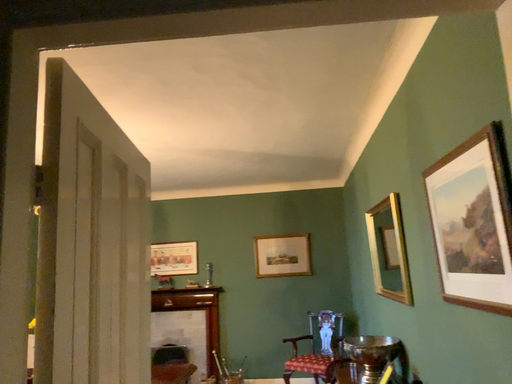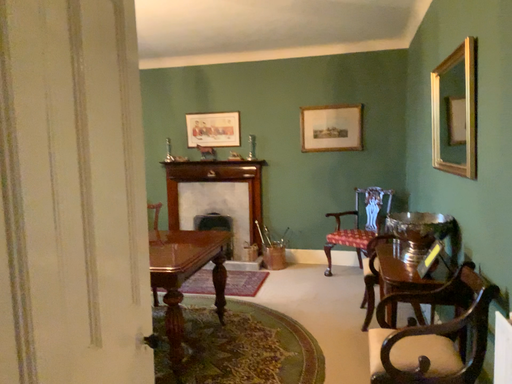
Question: Which way did the camera rotate in the video?

Choices:
 (A) rotated downward
 (B) rotated upward

Answer: (A)